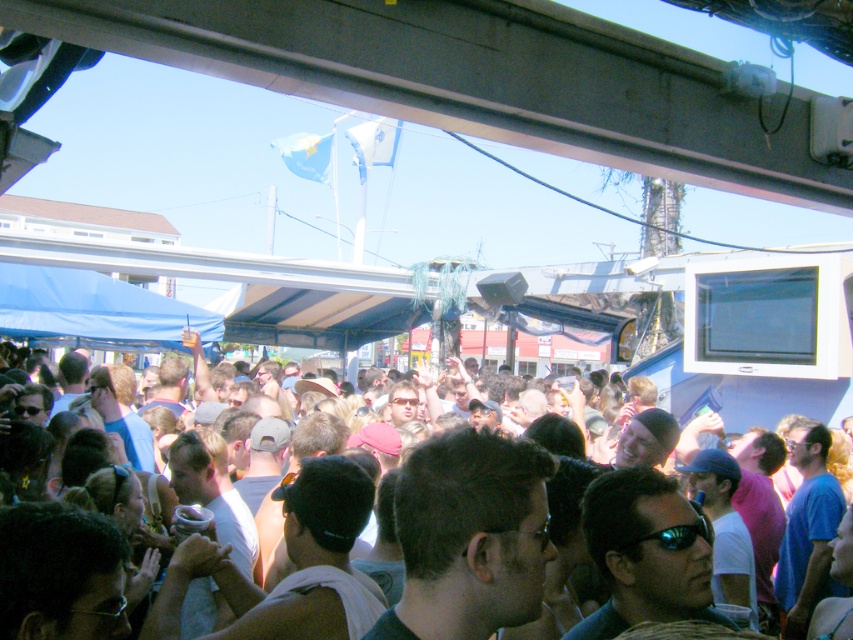
Question: Is the position of white cotton shirt at center more distant than that of black reflective sunglasses at center?

Choices:
 (A) no
 (B) yes

Answer: (B)

Question: Among these points, which one is nearest to the camera?

Choices:
 (A) (183, 470)
 (B) (688, 525)

Answer: (B)

Question: Among these objects, which one is nearest to the camera?

Choices:
 (A) white cotton shirt at center
 (B) black reflective sunglasses at center

Answer: (B)

Question: Is white cotton shirt at center thinner than black reflective sunglasses at center?

Choices:
 (A) no
 (B) yes

Answer: (A)

Question: From the image, what is the correct spatial relationship of white cotton shirt at center in relation to black reflective sunglasses at center?

Choices:
 (A) right
 (B) left

Answer: (B)